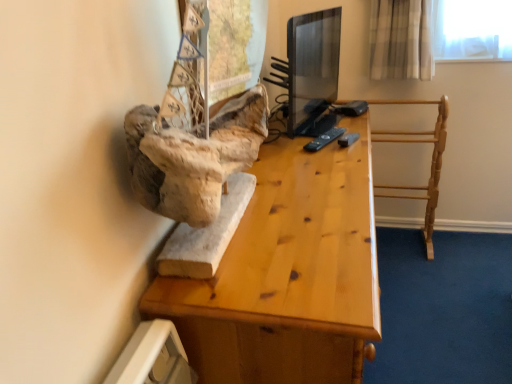
Locate an element on the screen. The height and width of the screenshot is (384, 512). wooden desk at center is located at coordinates (288, 274).

Image resolution: width=512 pixels, height=384 pixels. What are the coordinates of `black plastic remote at center` in the screenshot? It's located at (324, 139).

Is black plastic remote at center directly adjacent to light wood towel rack at right?

No, black plastic remote at center is not next to light wood towel rack at right.

In the scene shown: Is black plastic remote at center bigger or smaller than light wood towel rack at right?

Considering their sizes, black plastic remote at center takes up less space than light wood towel rack at right.

Which of these two, black plastic remote at center or light wood towel rack at right, stands shorter?

With less height is black plastic remote at center.

This screenshot has height=384, width=512. I want to click on furniture that is below the black plastic remote at center (from the image's perspective), so click(x=431, y=159).

What's the angular difference between light wood towel rack at right and wooden desk at center's facing directions?

The angular difference between light wood towel rack at right and wooden desk at center is 90 degrees.

Is the depth of light wood towel rack at right less than that of wooden desk at center?

No, light wood towel rack at right is further to the viewer.

In terms of height, does light wood towel rack at right look taller or shorter compared to wooden desk at center?

Clearly, light wood towel rack at right is shorter compared to wooden desk at center.

From the image's perspective, which is below, light wood towel rack at right or wooden desk at center?

wooden desk at center appears lower in the image.

From a real-world perspective, which is physically above, black plastic remote at center or wooden desk at center?

From a 3D spatial view, black plastic remote at center is above.

Based on the photo, is black plastic remote at center oriented away from wooden desk at center?

Yes, black plastic remote at center's orientation is away from wooden desk at center.

Is black plastic remote at center at the right side of wooden desk at center?

Correct, you'll find black plastic remote at center to the right of wooden desk at center.

From a real-world perspective, is light wood towel rack at right on black plastic remote at center?

No, from a real-world perspective, light wood towel rack at right is not above black plastic remote at center.

Considering the positions of objects light wood towel rack at right and black plastic remote at center in the image provided, who is more to the right, light wood towel rack at right or black plastic remote at center?

From the viewer's perspective, light wood towel rack at right appears more on the right side.

Is light wood towel rack at right next to black plastic remote at center and touching it?

light wood towel rack at right is not next to black plastic remote at center, and they're not touching.

From the image's perspective, which is below, light wood towel rack at right or black plastic remote at center?

light wood towel rack at right appears lower in the image.

From a real-world perspective, which object stands above the other?

black plastic remote at center is physically above.

From the image's perspective, is wooden desk at center above or below black plastic remote at center?

wooden desk at center is situated lower than black plastic remote at center in the image.

What's the angular difference between wooden desk at center and black plastic remote at center's facing directions?

There is a 24.5-degree angle between the facing directions of wooden desk at center and black plastic remote at center.

Is point (346, 175) positioned before point (328, 142)?

Yes, it is.

Is point (328, 321) more distant than point (440, 154)?

No, (328, 321) is in front of (440, 154).

Is the surface of wooden desk at center in direct contact with light wood towel rack at right?

No, wooden desk at center is not next to light wood towel rack at right.

Is wooden desk at center oriented towards light wood towel rack at right?

No, wooden desk at center is not turned towards light wood towel rack at right.

Considering the relative positions of wooden desk at center and light wood towel rack at right in the image provided, is wooden desk at center in front of light wood towel rack at right?

Yes.

In the image, there is a light wood towel rack at right. Identify the location of remote above it (from the image's perspective). (324, 139).

Where is `furniture on the right side of wooden desk at center`? This screenshot has height=384, width=512. furniture on the right side of wooden desk at center is located at coordinates (x=431, y=159).

When comparing their distances from wooden desk at center, does light wood towel rack at right or black plastic remote at center seem closer?

Based on the image, black plastic remote at center appears to be nearer to wooden desk at center.

Which object lies further to the anchor point light wood towel rack at right, wooden desk at center or black plastic remote at center?

wooden desk at center.

From the picture: Looking at the image, which one is located further to black plastic remote at center, wooden desk at center or light wood towel rack at right?

Among the two, light wood towel rack at right is located further to black plastic remote at center.

Based on their spatial positions, is black plastic remote at center or wooden desk at center further from light wood towel rack at right?

Based on the image, wooden desk at center appears to be further to light wood towel rack at right.

Based on their spatial positions, is black plastic remote at center or light wood towel rack at right further from wooden desk at center?

Based on the image, light wood towel rack at right appears to be further to wooden desk at center.

When comparing their distances from black plastic remote at center, does light wood towel rack at right or wooden desk at center seem closer?

wooden desk at center lies closer to black plastic remote at center than the other object.

You are a GUI agent. You are given a task and a screenshot of the screen. Output one action in this format:
    pyautogui.click(x=<x>, y=<y>)
    Task: Click on the remote positioned between wooden desk at center and light wood towel rack at right from near to far
    
    Given the screenshot: What is the action you would take?
    pyautogui.click(x=324, y=139)